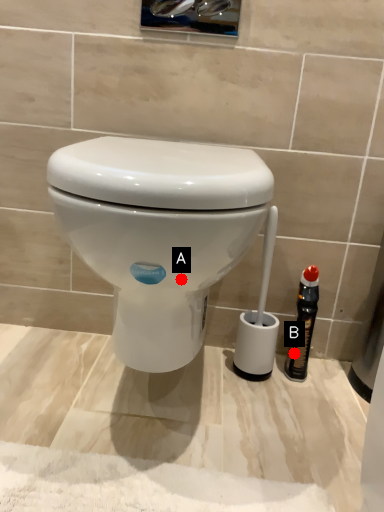
Question: Two points are circled on the image, labeled by A and B beside each circle. Which point is closer to the camera taking this photo?

Choices:
 (A) A is closer
 (B) B is closer

Answer: (A)